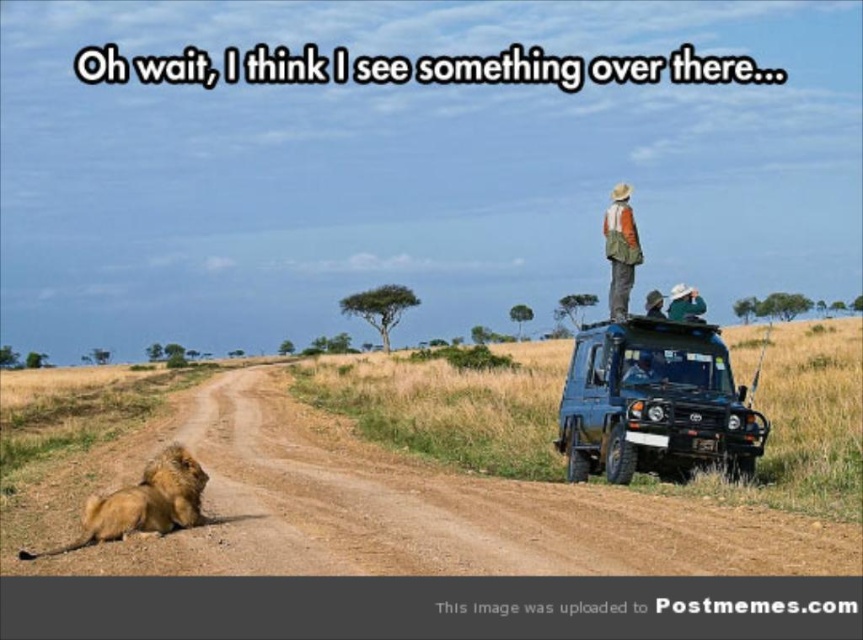
Question: Which of the following is the closest to the observer?

Choices:
 (A) brown dirt track at lower left
 (B) green fabric hat at upper center
 (C) orange fabric hat at upper right

Answer: (A)

Question: Can you confirm if orange fabric hat at upper right is positioned above matte black camera at upper center?

Choices:
 (A) yes
 (B) no

Answer: (A)

Question: Which of the following is the farthest from the observer?

Choices:
 (A) (836, 564)
 (B) (700, 340)
 (C) (615, 189)
 (D) (663, 376)

Answer: (C)

Question: Does golden fur lion at lower left have a greater width compared to orange fabric hat at upper right?

Choices:
 (A) no
 (B) yes

Answer: (A)

Question: Does golden fur lion at lower left have a greater width compared to orange fabric hat at upper right?

Choices:
 (A) no
 (B) yes

Answer: (A)

Question: Which of the following is the closest to the observer?

Choices:
 (A) (678, 346)
 (B) (622, 244)
 (C) (682, 300)

Answer: (A)